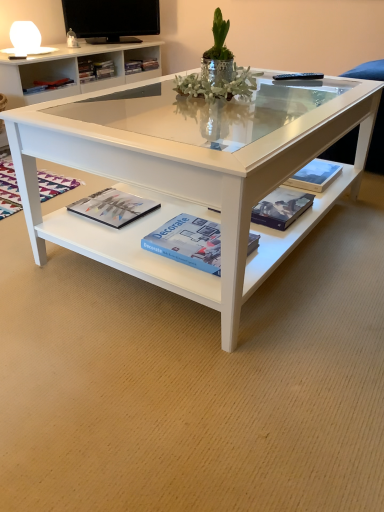
Question: From the image's perspective, would you say matte black magazine at lower left, which appears as the 3th magazine when viewed from the right, is shown under hardcover book at center, the 2th paperback book from the left?

Choices:
 (A) no
 (B) yes

Answer: (B)

Question: Considering the relative sizes of matte black magazine at lower left, which appears as the 3th magazine when viewed from the right, and hardcover book at center, which is the first paperback book from top to bottom, in the image provided, is matte black magazine at lower left, which appears as the 3th magazine when viewed from the right, thinner than hardcover book at center, which is the first paperback book from top to bottom,?

Choices:
 (A) yes
 (B) no

Answer: (B)

Question: Can you confirm if matte black magazine at lower left, which is the 1th magazine in left-to-right order, is shorter than hardcover book at center, which appears as the 2th paperback book when viewed from the front?

Choices:
 (A) yes
 (B) no

Answer: (A)

Question: Does matte black magazine at lower left, which is the 1th magazine in left-to-right order, have a larger size compared to hardcover book at center, arranged as the first paperback book when viewed from the back?

Choices:
 (A) no
 (B) yes

Answer: (B)

Question: From a real-world perspective, is matte black magazine at lower left, which is the 1th magazine in left-to-right order, located beneath hardcover book at center, which is the first paperback book from top to bottom?

Choices:
 (A) no
 (B) yes

Answer: (B)

Question: From a real-world perspective, is black glossy television at upper center above or below white glossy coffee table at center?

Choices:
 (A) below
 (B) above

Answer: (B)

Question: From their relative heights in the image, would you say black glossy television at upper center is taller or shorter than white glossy coffee table at center?

Choices:
 (A) tall
 (B) short

Answer: (B)

Question: Is black glossy television at upper center wider or thinner than white glossy coffee table at center?

Choices:
 (A) thin
 (B) wide

Answer: (A)

Question: Do you think black glossy television at upper center is within white glossy coffee table at center, or outside of it?

Choices:
 (A) outside
 (B) inside

Answer: (A)

Question: Considering the positions of matte black book at lower center, which is counted as the third magazine, starting from the left, and matte black magazine at lower left, which appears as the 3th magazine when viewed from the right, in the image, is matte black book at lower center, which is counted as the third magazine, starting from the left, bigger or smaller than matte black magazine at lower left, which appears as the 3th magazine when viewed from the right,?

Choices:
 (A) small
 (B) big

Answer: (A)

Question: Is point (276, 219) closer or farther from the camera than point (6, 183)?

Choices:
 (A) closer
 (B) farther

Answer: (A)

Question: From their relative heights in the image, would you say matte black book at lower center, which is the 1th magazine from right to left, is taller or shorter than matte black magazine at lower left, which appears as the 3th magazine when viewed from the right?

Choices:
 (A) tall
 (B) short

Answer: (A)

Question: From a real-world perspective, relative to matte black magazine at lower left, which is the 1th magazine in left-to-right order, is matte black book at lower center, which is the 1th magazine from right to left, vertically above or below?

Choices:
 (A) below
 (B) above

Answer: (B)

Question: Relative to white glossy coffee table at center, is blue matte paperback book at center, arranged as the second paperback book when viewed from the top, in front or behind?

Choices:
 (A) front
 (B) behind

Answer: (B)

Question: From a real-world perspective, is blue matte paperback book at center, placed as the first paperback book when sorted from bottom to top, above or below white glossy coffee table at center?

Choices:
 (A) above
 (B) below

Answer: (B)